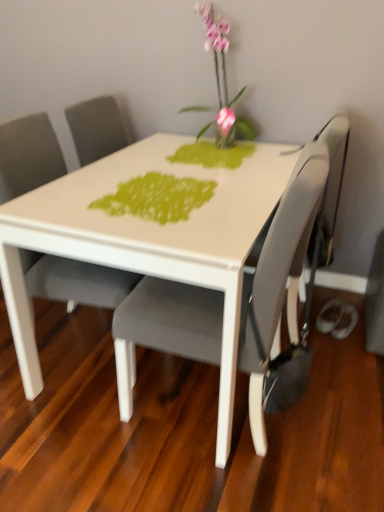
Where is `vacant space to the right of green textured placemat at center`? This screenshot has height=512, width=384. vacant space to the right of green textured placemat at center is located at coordinates (249, 193).